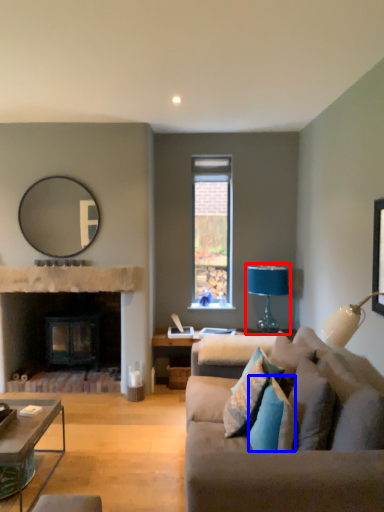
Question: Which object is further to the camera taking this photo, table lamp (highlighted by a red box) or pillow (highlighted by a blue box)?

Choices:
 (A) table lamp
 (B) pillow

Answer: (A)